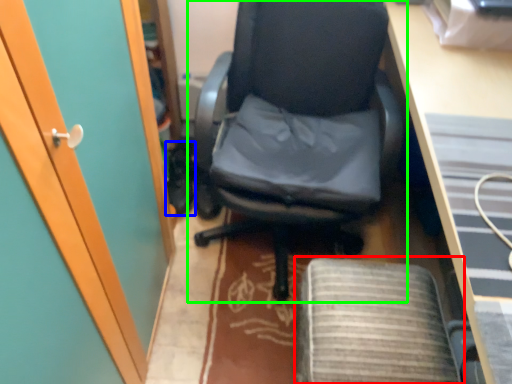
Question: Considering the real-world distances, which object is closest to computer chair (highlighted by a red box)? footwear (highlighted by a blue box) or chair (highlighted by a green box).

Choices:
 (A) footwear
 (B) chair

Answer: (B)